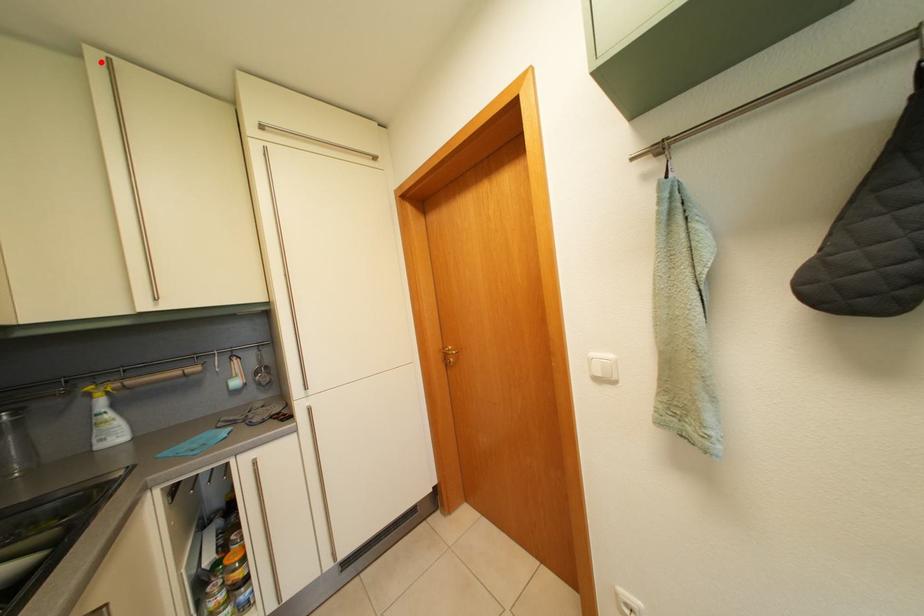
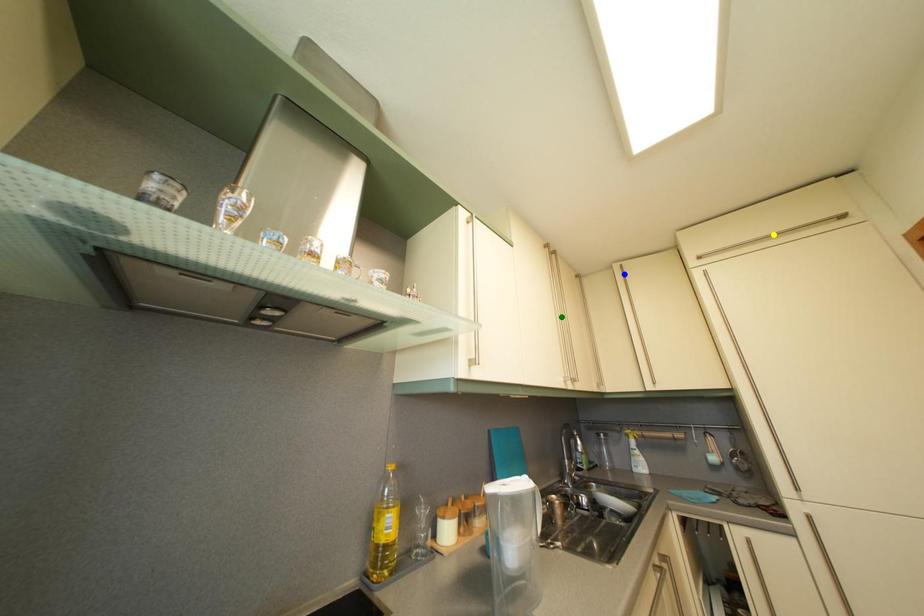
Question: I am providing you with two images of the same scene from different viewpoints. A red point is marked on the first image. You are given multiple points on the second image. Which point in image 2 represents the same 3d spot as the red point in image 1?

Choices:
 (A) blue point
 (B) green point
 (C) yellow point

Answer: (A)